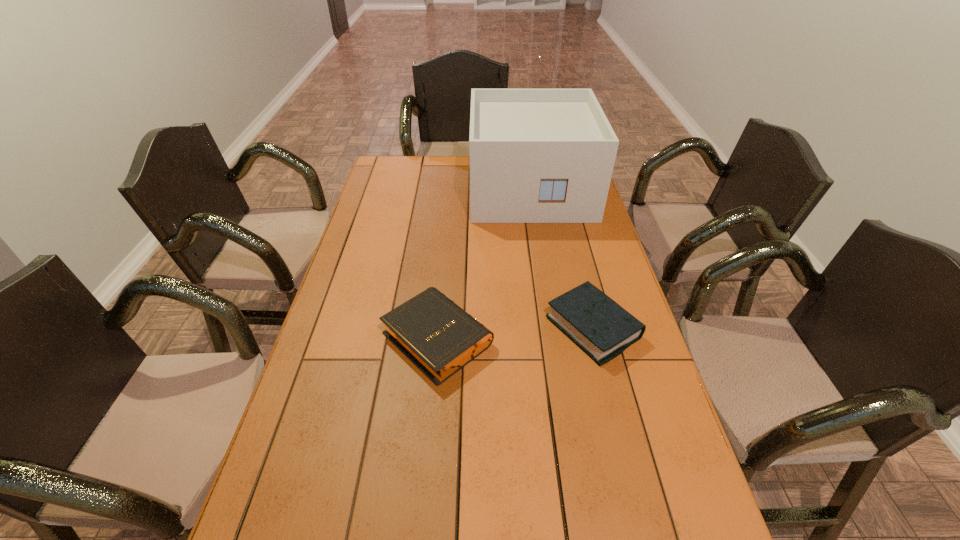
Find the location of a particular element. The width and height of the screenshot is (960, 540). object that is at the far right corner is located at coordinates (536, 155).

Locate an element on the screen. Image resolution: width=960 pixels, height=540 pixels. vacant space at the far edge of the desktop is located at coordinates (436, 164).

You are a GUI agent. You are given a task and a screenshot of the screen. Output one action in this format:
    pyautogui.click(x=<x>, y=<y>)
    Task: Click on the vacant space at the left edge of the desktop
    The height and width of the screenshot is (540, 960).
    Given the screenshot: What is the action you would take?
    pyautogui.click(x=332, y=302)

Find the location of `vacant space at the right edge of the desktop`. vacant space at the right edge of the desktop is located at coordinates (620, 273).

This screenshot has width=960, height=540. In the image, there is a desktop. In order to click on vacant space at the far left corner in this screenshot , I will do `click(394, 178)`.

At what (x,y) coordinates should I click in order to perform the action: click on empty space between the tallest object and the left Bible. Please return your answer as a coordinate pair (x, y). The image size is (960, 540). Looking at the image, I should click on (484, 263).

This screenshot has height=540, width=960. What are the coordinates of `unoccupied position between the farthest object and the left Bible` in the screenshot? It's located at (484, 263).

You are a GUI agent. You are given a task and a screenshot of the screen. Output one action in this format:
    pyautogui.click(x=<x>, y=<y>)
    Task: Click on the empty space that is in between the right Bible and the left Bible
    
    Given the screenshot: What is the action you would take?
    pyautogui.click(x=516, y=332)

The width and height of the screenshot is (960, 540). Identify the location of free space that is in between the left Bible and the right Bible. (516, 332).

This screenshot has height=540, width=960. Find the location of `unoccupied position between the tallest object and the right Bible`. unoccupied position between the tallest object and the right Bible is located at coordinates (562, 258).